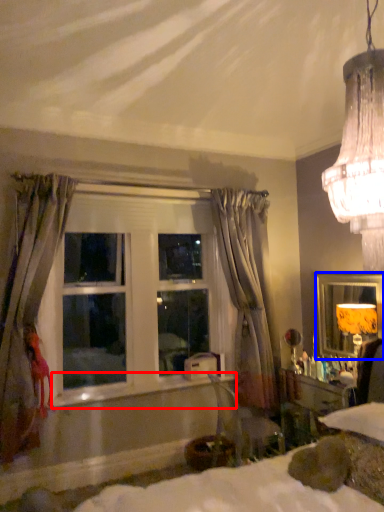
Question: Which object appears farthest to the camera in this image, window sill (highlighted by a red box) or mirror (highlighted by a blue box)?

Choices:
 (A) window sill
 (B) mirror

Answer: (B)